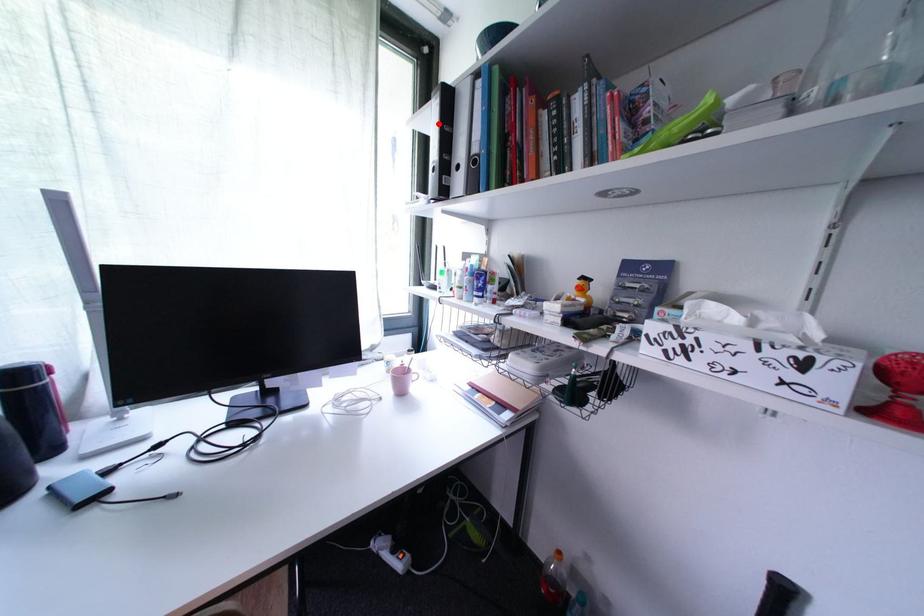
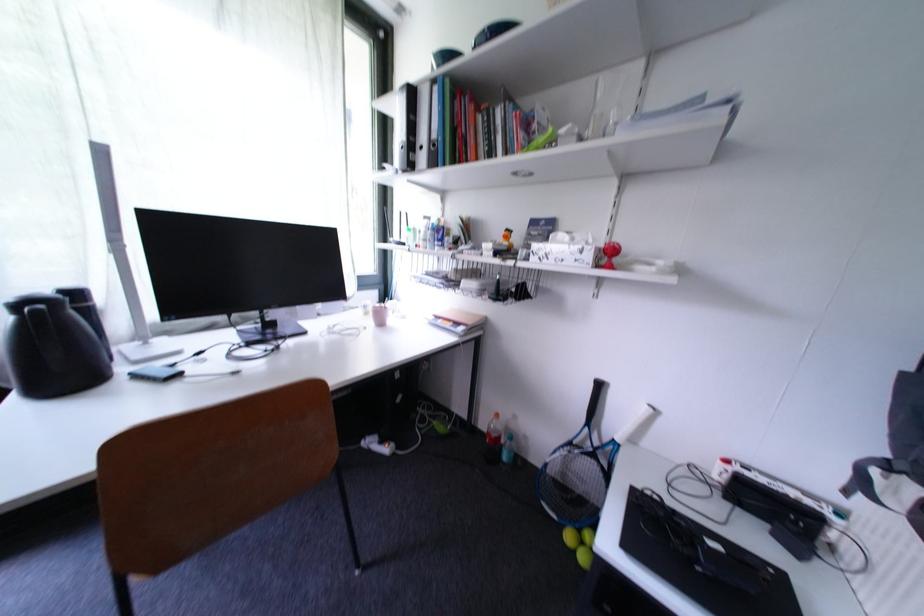
In the second image, find the point that corresponds to the highlighted location in the first image.

(405, 110)